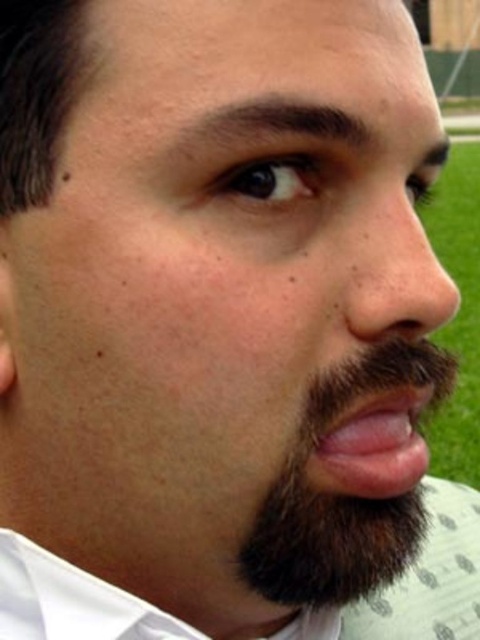
Question: Which object is farther from the camera taking this photo?

Choices:
 (A) brown fuzzy beard at center
 (B) pink flesh at center

Answer: (B)

Question: Considering the relative positions of brown fuzzy beard at center and pink flesh at center in the image provided, where is brown fuzzy beard at center located with respect to pink flesh at center?

Choices:
 (A) right
 (B) left

Answer: (B)

Question: Is brown fuzzy beard at center bigger than pink flesh at center?

Choices:
 (A) no
 (B) yes

Answer: (B)

Question: Which point is farther from the camera taking this photo?

Choices:
 (A) (361, 481)
 (B) (342, 518)

Answer: (B)

Question: Does brown fuzzy beard at center appear under pink flesh at center?

Choices:
 (A) yes
 (B) no

Answer: (A)